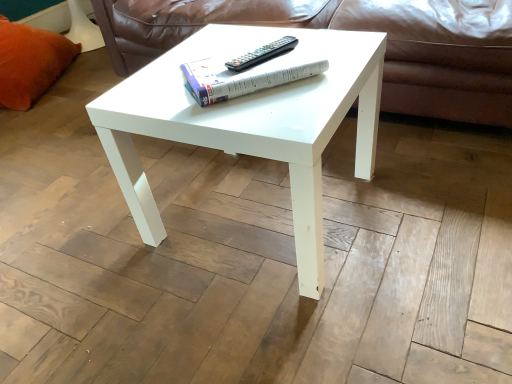
At what (x,y) coordinates should I click in order to perform the action: click on free location in front of white paper at center. Please return your answer as a coordinate pair (x, y). The height and width of the screenshot is (384, 512). Looking at the image, I should click on (265, 108).